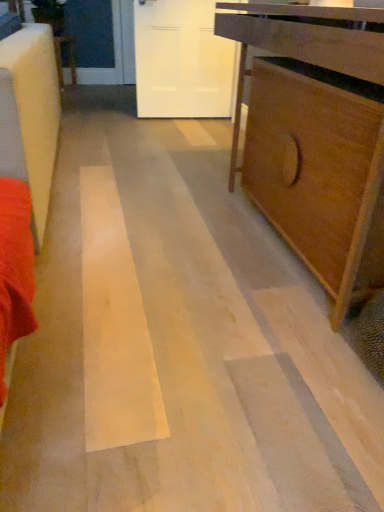
Question: From a real-world perspective, is wooden table at center over matte brown cabinet at right?

Choices:
 (A) yes
 (B) no

Answer: (B)

Question: Is the depth of wooden table at center greater than that of matte brown cabinet at right?

Choices:
 (A) yes
 (B) no

Answer: (A)

Question: Is wooden table at center facing towards matte brown cabinet at right?

Choices:
 (A) yes
 (B) no

Answer: (B)

Question: Considering the relative sizes of wooden table at center and matte brown cabinet at right in the image provided, is wooden table at center bigger than matte brown cabinet at right?

Choices:
 (A) yes
 (B) no

Answer: (B)

Question: Does wooden table at center have a greater height compared to matte brown cabinet at right?

Choices:
 (A) yes
 (B) no

Answer: (B)

Question: Can we say wooden table at center lies outside matte brown cabinet at right?

Choices:
 (A) no
 (B) yes

Answer: (B)

Question: From a real-world perspective, is white matte door at upper center over matte brown cabinet at right?

Choices:
 (A) yes
 (B) no

Answer: (A)

Question: Does white matte door at upper center touch matte brown cabinet at right?

Choices:
 (A) no
 (B) yes

Answer: (A)

Question: Considering the relative sizes of white matte door at upper center and matte brown cabinet at right in the image provided, is white matte door at upper center smaller than matte brown cabinet at right?

Choices:
 (A) no
 (B) yes

Answer: (B)

Question: Does white matte door at upper center have a greater width compared to matte brown cabinet at right?

Choices:
 (A) yes
 (B) no

Answer: (B)

Question: Would you say matte brown cabinet at right is part of white matte door at upper center's contents?

Choices:
 (A) yes
 (B) no

Answer: (B)

Question: Is white matte door at upper center taller than matte brown cabinet at right?

Choices:
 (A) no
 (B) yes

Answer: (B)

Question: From a real-world perspective, does matte brown cabinet at right sit lower than wooden table at center?

Choices:
 (A) no
 (B) yes

Answer: (A)